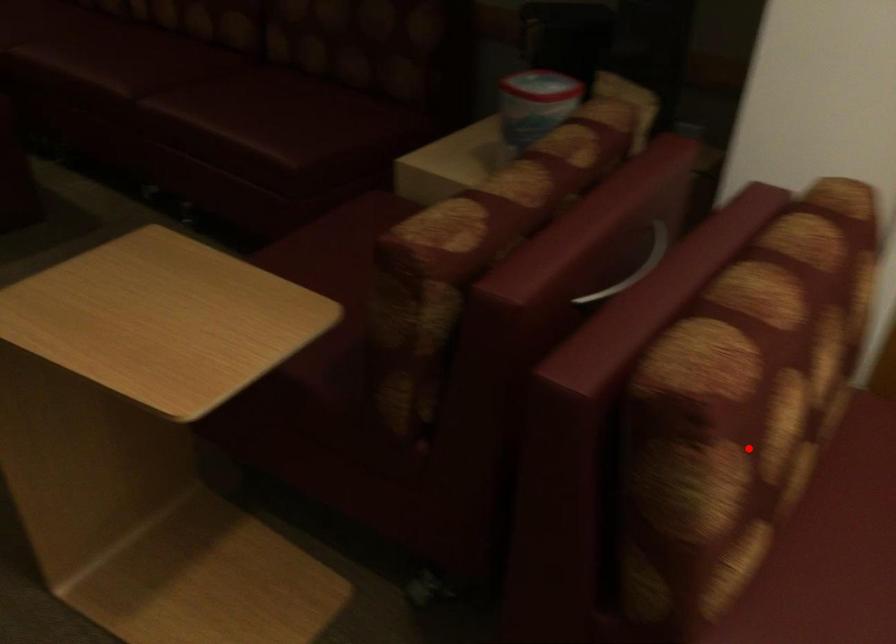
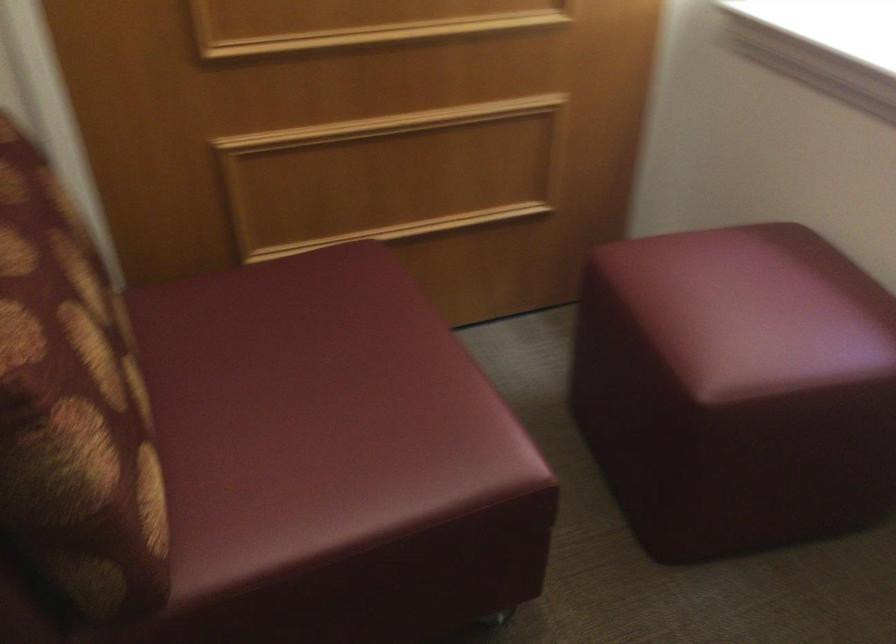
Where in the second image is the point corresponding to the highlighted location from the first image?

(72, 406)